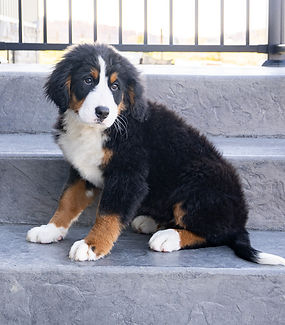
At what (x,y) coordinates should I click in order to perform the action: click on right front leg. Please return your answer as a coordinate pair (x, y). The image size is (285, 325). Looking at the image, I should click on (70, 199).